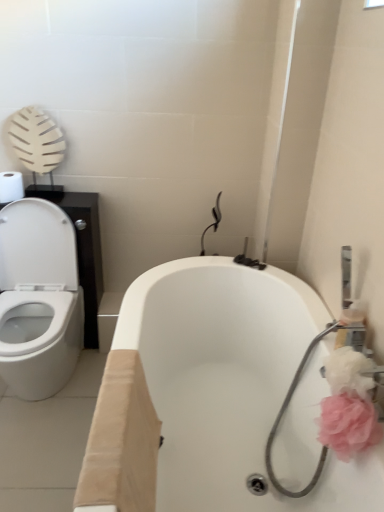
Question: From a real-world perspective, is pink fabric flower at right, which appears as the first flower when ordered from the bottom, positioned above or below white glossy bathtub at center?

Choices:
 (A) below
 (B) above

Answer: (B)

Question: From the image's perspective, relative to white glossy bathtub at center, is pink fabric flower at right, which appears as the first flower when ordered from the bottom, above or below?

Choices:
 (A) above
 (B) below

Answer: (A)

Question: Which object is the farthest from the pink fluffy flower at right, acting as the second flower starting from the bottom?

Choices:
 (A) white glossy bathtub at center
 (B) white matte toilet paper at upper left
 (C) pink fabric flower at right, which appears as the first flower when ordered from the bottom

Answer: (B)

Question: Estimate the real-world distances between objects in this image. Which object is closer to the white glossy bathtub at center?

Choices:
 (A) pink fabric flower at right, which appears as the first flower when ordered from the bottom
 (B) white matte toilet paper at upper left
 (C) pink fluffy flower at right, acting as the second flower starting from the bottom

Answer: (A)